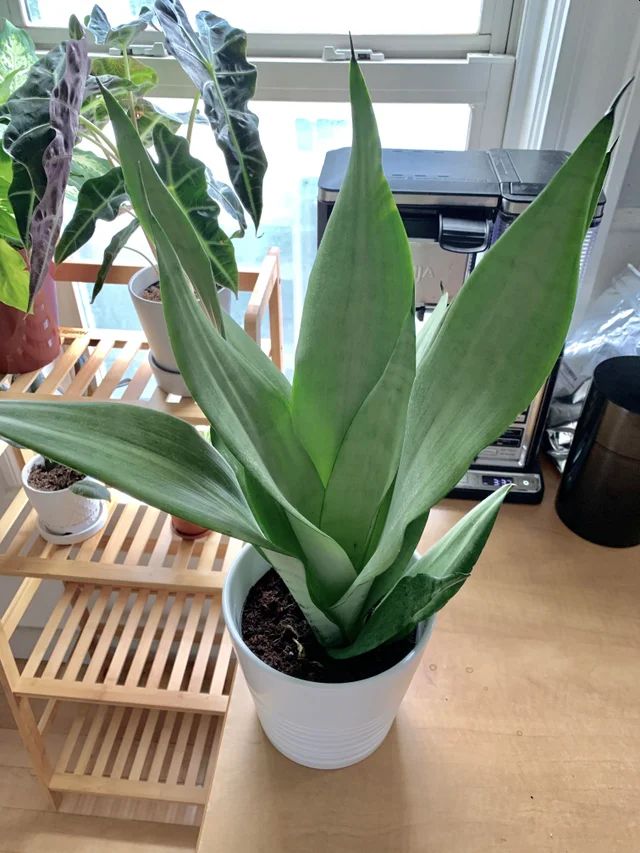
I want to click on white wall, so pyautogui.click(x=43, y=608).